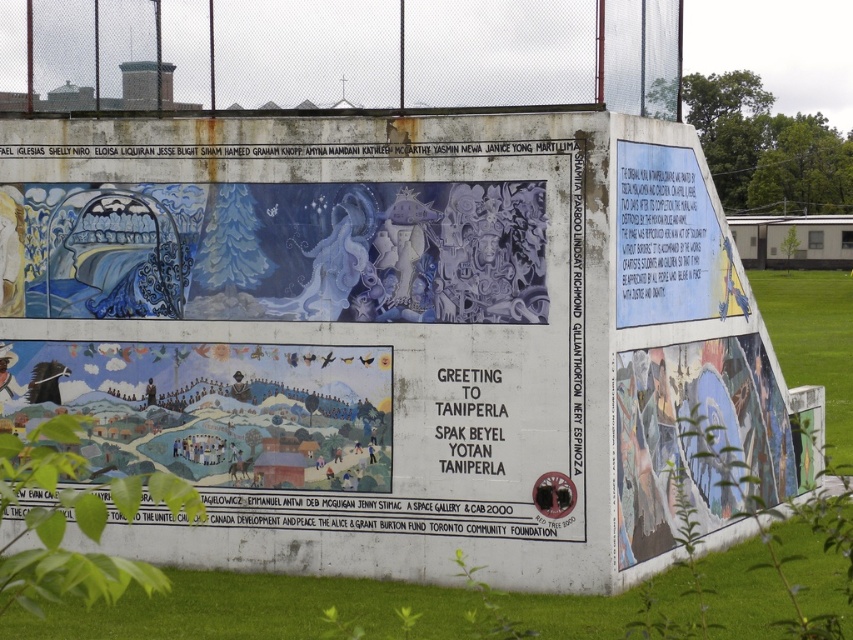
Question: Which object appears farthest from the camera in this image?

Choices:
 (A) white paper plaque at upper right
 (B) matte blue mural at center
 (C) matte blue mural at right
 (D) rusty metal fence at upper center

Answer: (C)

Question: Is matte blue mural at center smaller than rusty metal fence at upper center?

Choices:
 (A) no
 (B) yes

Answer: (A)

Question: Which point is farther from the camera taking this photo?

Choices:
 (A) (651, 148)
 (B) (390, 20)

Answer: (A)

Question: From the image, what is the correct spatial relationship of pastel painted mural at center in relation to white paper plaque at upper right?

Choices:
 (A) left
 (B) right

Answer: (A)

Question: Which point is closer to the camera?

Choices:
 (A) white paper plaque at upper right
 (B) matte blue mural at right
 (C) matte blue mural at center
 (D) pastel painted mural at center

Answer: (C)

Question: Does rusty metal fence at upper center appear on the left side of white paper plaque at upper right?

Choices:
 (A) yes
 (B) no

Answer: (A)